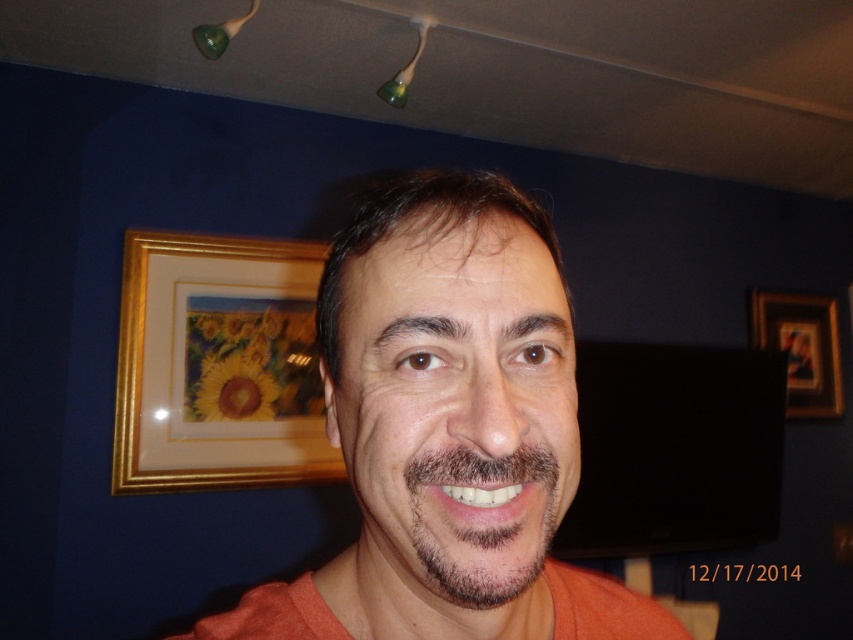
Is point (480, 632) behind point (782, 348)?

No, (480, 632) is in front of (782, 348).

Is orange matte shirt at center bigger than gold-framed picture at upper right?

No.

Locate an element on the screen. orange matte shirt at center is located at coordinates (448, 432).

Where is `orange matte shirt at center`? The width and height of the screenshot is (853, 640). orange matte shirt at center is located at coordinates (448, 432).

Is gold framed picture at upper left below gold-framed picture at upper right?

Indeed, gold framed picture at upper left is positioned under gold-framed picture at upper right.

Which is behind, point (181, 358) or point (817, 342)?

Positioned behind is point (817, 342).

At what (x,y) coordinates should I click in order to perform the action: click on gold framed picture at upper left. Please return your answer as a coordinate pair (x, y). The height and width of the screenshot is (640, 853). Looking at the image, I should click on (218, 364).

Locate an element on the screen. orange matte shirt at center is located at coordinates (448, 432).

Does orange matte shirt at center appear under gold framed picture at upper left?

Correct, orange matte shirt at center is located below gold framed picture at upper left.

Which is in front, point (463, 563) or point (231, 406)?

Point (463, 563) is in front.

In order to click on orange matte shirt at center in this screenshot , I will do `click(448, 432)`.